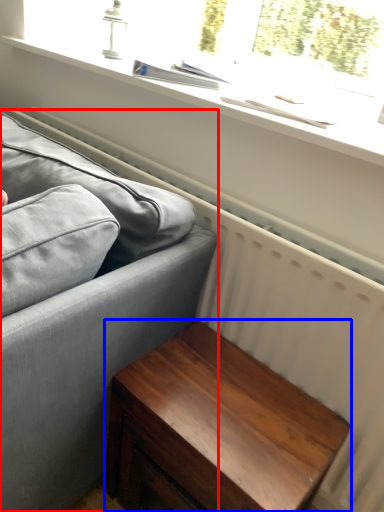
Question: Which of the following is the farthest to the observer, studio couch (highlighted by a red box) or table (highlighted by a blue box)?

Choices:
 (A) studio couch
 (B) table

Answer: (B)